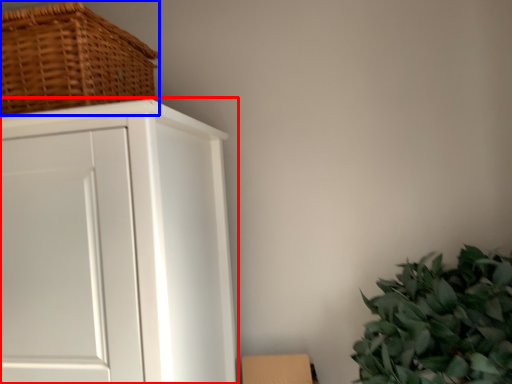
Question: Which object appears farthest to the camera in this image, cupboard (highlighted by a red box) or basket (highlighted by a blue box)?

Choices:
 (A) cupboard
 (B) basket

Answer: (B)